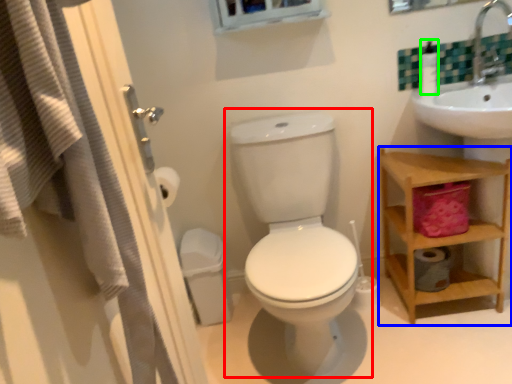
Question: Which object is positioned closest to toilet (highlighted by a red box)? Select from shelf (highlighted by a blue box) and soap dispenser (highlighted by a green box).

Choices:
 (A) shelf
 (B) soap dispenser

Answer: (A)